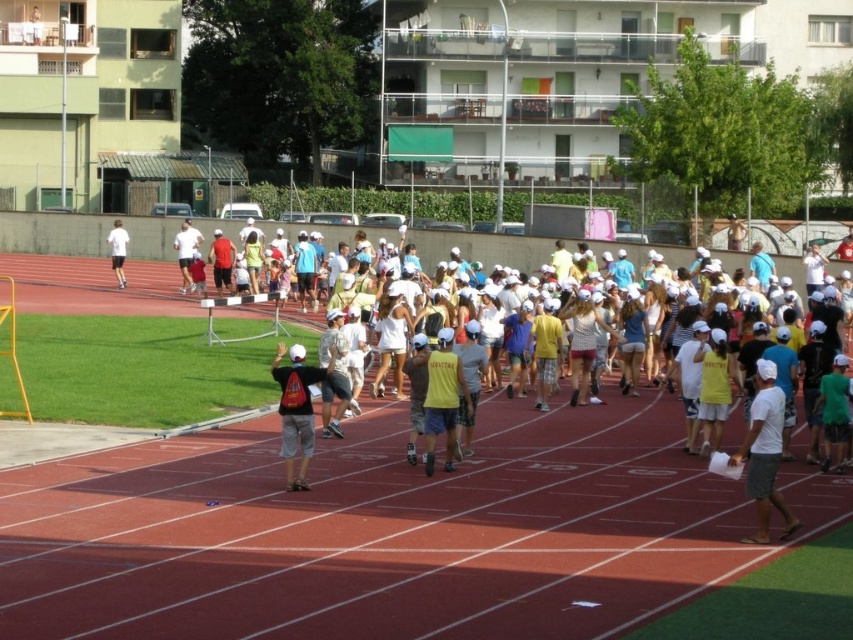
Between white matte shirt at lower right and white matte t-shirt at left, which one is positioned higher?

white matte t-shirt at left

Is white matte shirt at lower right smaller than white matte t-shirt at left?

Yes.

The width and height of the screenshot is (853, 640). I want to click on white matte shirt at lower right, so click(x=764, y=452).

At what (x,y) coordinates should I click in order to perform the action: click on white matte shirt at lower right. Please return your answer as a coordinate pair (x, y). Image resolution: width=853 pixels, height=640 pixels. Looking at the image, I should click on (764, 452).

Is yellow matte shirt at center behind white matte shorts at center?

That is False.

Does yellow matte shirt at center have a greater width compared to white matte shorts at center?

No, yellow matte shirt at center is not wider than white matte shorts at center.

Who is more forward, (447, 330) or (192, 227)?

Point (447, 330) is in front.

Locate an element on the screen. yellow matte shirt at center is located at coordinates (442, 397).

Where is `matte gray shorts at center`? This screenshot has height=640, width=853. matte gray shorts at center is located at coordinates (296, 410).

The height and width of the screenshot is (640, 853). What do you see at coordinates (296, 410) in the screenshot?
I see `matte gray shorts at center` at bounding box center [296, 410].

Identify the location of matte gray shorts at center. The width and height of the screenshot is (853, 640). (296, 410).